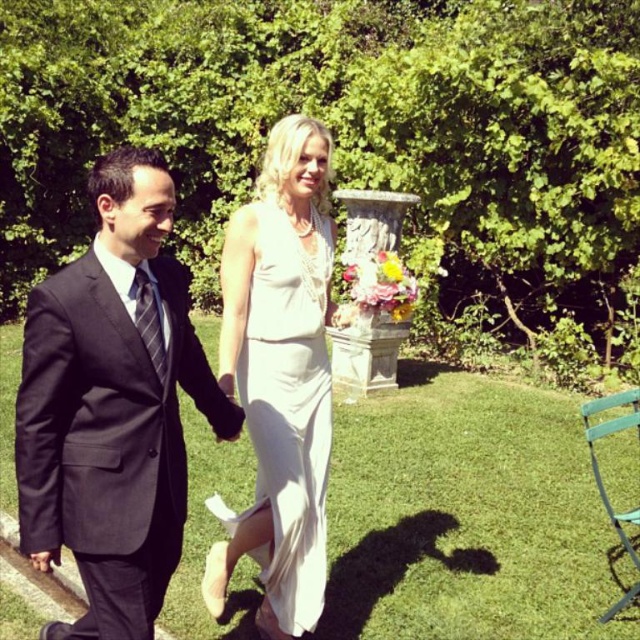
Does green grass at center have a larger size compared to black suit at left?

No, green grass at center is not bigger than black suit at left.

Between green grass at center and black suit at left, which one has more height?

Standing taller between the two is black suit at left.

Where is `green grass at center`? This screenshot has height=640, width=640. green grass at center is located at coordinates (467, 516).

Can you confirm if black suit at left is positioned to the left of white satin dress at center?

Indeed, black suit at left is positioned on the left side of white satin dress at center.

Can you confirm if black suit at left is shorter than white satin dress at center?

No, black suit at left is not shorter than white satin dress at center.

What do you see at coordinates (113, 406) in the screenshot? I see `black suit at left` at bounding box center [113, 406].

The image size is (640, 640). Find the location of `black suit at left`. black suit at left is located at coordinates (113, 406).

Which is behind, point (424, 362) or point (321, 326)?

The point (424, 362) is behind.

Does green grass at center have a smaller size compared to white satin dress at center?

Indeed, green grass at center has a smaller size compared to white satin dress at center.

The height and width of the screenshot is (640, 640). I want to click on green grass at center, so click(467, 516).